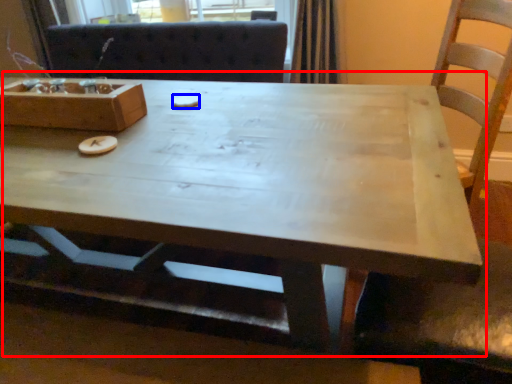
Question: Which point is further to the camera, coffee table (highlighted by a red box) or food (highlighted by a blue box)?

Choices:
 (A) coffee table
 (B) food

Answer: (B)